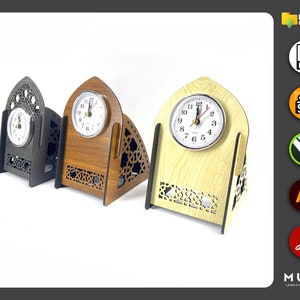
In order to click on 1 beige clock in this screenshot , I will do `click(213, 163)`.